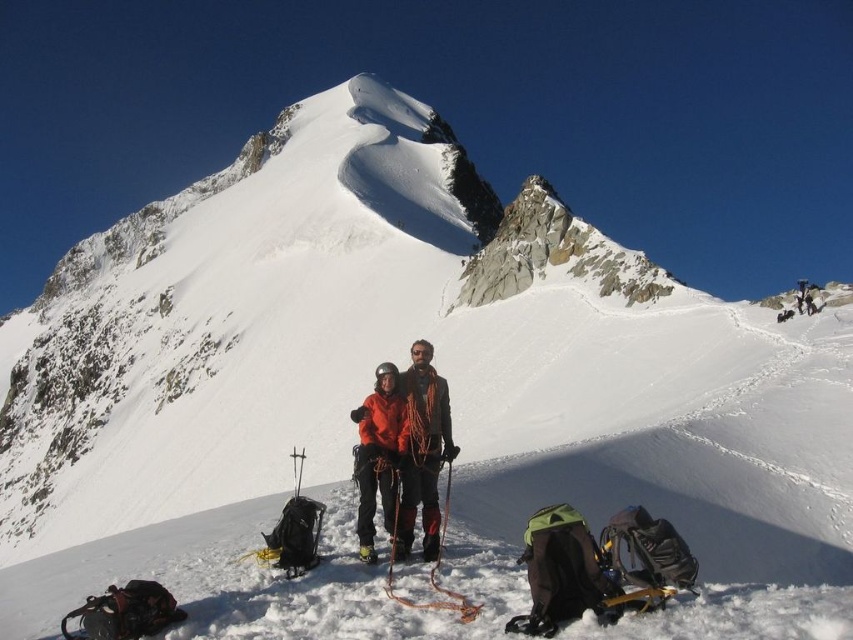
Question: Can you confirm if orange fabric jacket at center is positioned to the right of orange softshell jacket at center?

Choices:
 (A) yes
 (B) no

Answer: (A)

Question: Can you confirm if orange fabric jacket at center is positioned to the right of orange softshell jacket at center?

Choices:
 (A) yes
 (B) no

Answer: (A)

Question: From the image, what is the correct spatial relationship of orange fabric jacket at center in relation to orange softshell jacket at center?

Choices:
 (A) right
 (B) left

Answer: (A)

Question: Which object is closer to the camera taking this photo?

Choices:
 (A) orange softshell jacket at center
 (B) orange fabric jacket at center

Answer: (A)

Question: Which object is farther from the camera taking this photo?

Choices:
 (A) orange softshell jacket at center
 (B) orange fabric jacket at center

Answer: (B)

Question: Which point is farther to the camera?

Choices:
 (A) orange softshell jacket at center
 (B) orange fabric jacket at center

Answer: (B)